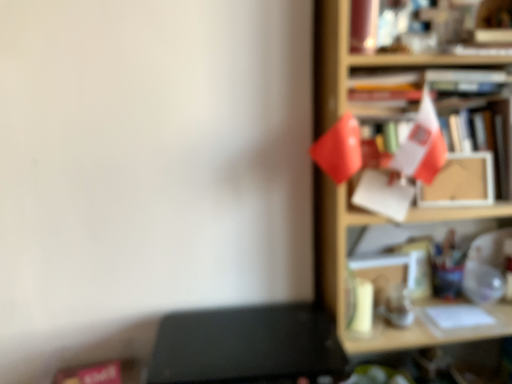
Describe the element at coordinates (398, 256) in the screenshot. I see `wooden shelf at right` at that location.

I want to click on wooden shelf at right, so click(x=398, y=256).

This screenshot has height=384, width=512. What do you see at coordinates (247, 346) in the screenshot?
I see `black matte writing desk at lower left` at bounding box center [247, 346].

I want to click on black matte writing desk at lower left, so click(x=247, y=346).

Locate an element on the screen. Image resolution: width=512 pixels, height=384 pixels. wooden shelf at right is located at coordinates (398, 256).

Which is more to the left, black matte writing desk at lower left or wooden shelf at right?

From the viewer's perspective, black matte writing desk at lower left appears more on the left side.

Which object is further away from the camera taking this photo, black matte writing desk at lower left or wooden shelf at right?

wooden shelf at right.

Does point (208, 318) lie in front of point (375, 162)?

No, it is behind (375, 162).

From the image's perspective, is black matte writing desk at lower left located above wooden shelf at right?

No, from the image's perspective, black matte writing desk at lower left is not on top of wooden shelf at right.

From a real-world perspective, between black matte writing desk at lower left and wooden shelf at right, who is vertically lower?

black matte writing desk at lower left is physically lower.

Considering the sizes of objects black matte writing desk at lower left and wooden shelf at right in the image provided, who is thinner, black matte writing desk at lower left or wooden shelf at right?

With smaller width is wooden shelf at right.

Which of these two, black matte writing desk at lower left or wooden shelf at right, stands taller?

With more height is wooden shelf at right.

Does black matte writing desk at lower left have a smaller size compared to wooden shelf at right?

Indeed, black matte writing desk at lower left has a smaller size compared to wooden shelf at right.

Do you think black matte writing desk at lower left is within wooden shelf at right, or outside of it?

black matte writing desk at lower left exists outside the volume of wooden shelf at right.

Is black matte writing desk at lower left beside wooden shelf at right?

No.

Is black matte writing desk at lower left looking in the opposite direction of wooden shelf at right?

That's not correct — black matte writing desk at lower left is not looking away from wooden shelf at right.

What's the angular difference between black matte writing desk at lower left and wooden shelf at right's facing directions?

The facing directions of black matte writing desk at lower left and wooden shelf at right are 1.89 degrees apart.

How far apart are black matte writing desk at lower left and wooden shelf at right?

The distance of black matte writing desk at lower left from wooden shelf at right is 12.80 inches.

Identify the location of shelf above the black matte writing desk at lower left (from a real-world perspective). pyautogui.click(x=398, y=256).

Between wooden shelf at right and black matte writing desk at lower left, which one appears on the left side from the viewer's perspective?

black matte writing desk at lower left.

Is wooden shelf at right positioned before black matte writing desk at lower left?

No.

Which is closer, (x=319, y=232) or (x=217, y=374)?

The point (x=217, y=374) is in front.

From the image's perspective, between wooden shelf at right and black matte writing desk at lower left, who is located below?

black matte writing desk at lower left is shown below in the image.

From a real-world perspective, is wooden shelf at right under black matte writing desk at lower left?

Incorrect, from a real-world perspective, wooden shelf at right is higher than black matte writing desk at lower left.

In terms of width, does wooden shelf at right look wider or thinner when compared to black matte writing desk at lower left?

Considering their sizes, wooden shelf at right looks slimmer than black matte writing desk at lower left.

Who is shorter, wooden shelf at right or black matte writing desk at lower left?

black matte writing desk at lower left.

Considering the sizes of wooden shelf at right and black matte writing desk at lower left in the image, is wooden shelf at right bigger or smaller than black matte writing desk at lower left?

Clearly, wooden shelf at right is larger in size than black matte writing desk at lower left.

Does wooden shelf at right contain black matte writing desk at lower left?

No, black matte writing desk at lower left is located outside of wooden shelf at right.

Is wooden shelf at right with black matte writing desk at lower left?

wooden shelf at right is not next to black matte writing desk at lower left, and they're not touching.

Is wooden shelf at right positioned with its back to black matte writing desk at lower left?

No, wooden shelf at right is not facing away from black matte writing desk at lower left.

From the picture: Can you tell me how much wooden shelf at right and black matte writing desk at lower left differ in facing direction?

They differ by 1.89 degrees in their facing directions.

This screenshot has width=512, height=384. In order to click on writing desk located below the wooden shelf at right (from the image's perspective) in this screenshot , I will do `click(247, 346)`.

In the image, there is a wooden shelf at right. What are the coordinates of `writing desk below it (from the image's perspective)` in the screenshot? It's located at (247, 346).

Where is `shelf on the right of black matte writing desk at lower left`? The width and height of the screenshot is (512, 384). shelf on the right of black matte writing desk at lower left is located at coordinates (398, 256).